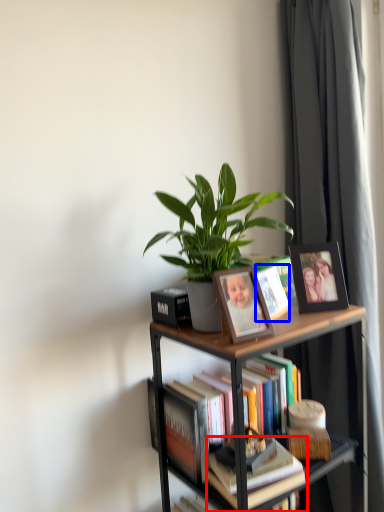
Question: Which point is further to the camera, book (highlighted by a red box) or book cover (highlighted by a blue box)?

Choices:
 (A) book
 (B) book cover

Answer: (B)